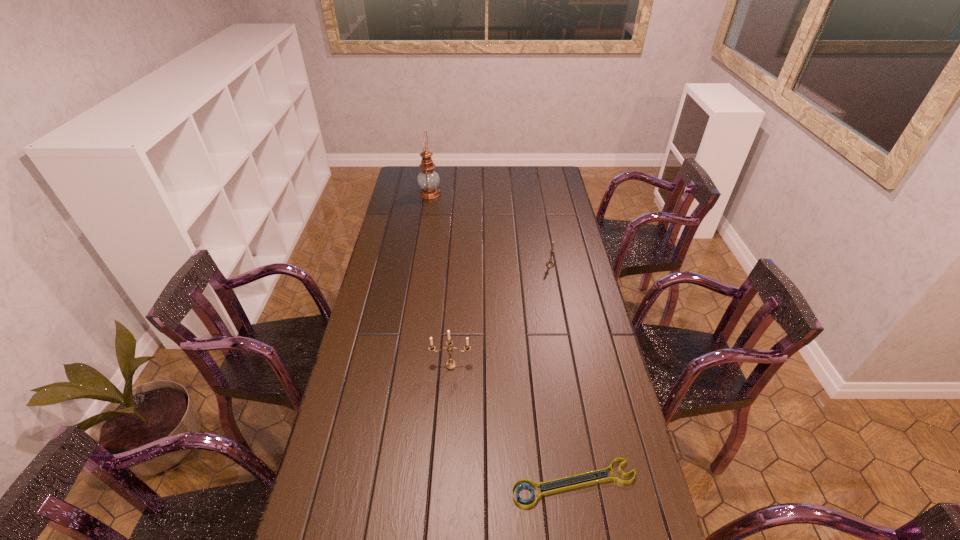
This screenshot has height=540, width=960. What are the coordinates of `free area in between the farther candle and the farthest object` in the screenshot? It's located at (490, 230).

Where is `vacant area that lies between the oil lamp and the shorter candle`? The height and width of the screenshot is (540, 960). vacant area that lies between the oil lamp and the shorter candle is located at coordinates (490, 230).

Locate which object is the closest to the oil lamp. Please provide its 2D coordinates. Your answer should be formatted as a tuple, i.e. [(x, y)], where the tuple contains the x and y coordinates of a point satisfying the conditions above.

[(550, 264)]

At what (x,y) coordinates should I click in order to perform the action: click on object that is the third closest to the third object from right to left. Please return your answer as a coordinate pair (x, y). This screenshot has width=960, height=540. Looking at the image, I should click on (428, 180).

This screenshot has width=960, height=540. I want to click on free space that satisfies the following two spatial constraints: 1. on the front side of the left candle; 2. on the left side of the tallest object, so click(402, 364).

Where is `free space in the image that satisfies the following two spatial constraints: 1. on the front side of the third object from right to left; 2. on the right side of the tallest object`? This screenshot has width=960, height=540. free space in the image that satisfies the following two spatial constraints: 1. on the front side of the third object from right to left; 2. on the right side of the tallest object is located at coordinates (402, 364).

The width and height of the screenshot is (960, 540). I want to click on free location that satisfies the following two spatial constraints: 1. on the back side of the third farthest object; 2. on the right side of the second shortest object, so click(457, 265).

You are a GUI agent. You are given a task and a screenshot of the screen. Output one action in this format:
    pyautogui.click(x=<x>, y=<y>)
    Task: Click on the vacant space that satisfies the following two spatial constraints: 1. on the front side of the shortest object; 2. on the left side of the leftmost object
    
    Given the screenshot: What is the action you would take?
    pyautogui.click(x=384, y=483)

Find the location of `free spot that satisfies the following two spatial constraints: 1. on the back side of the wrench; 2. on the left side of the right candle`. free spot that satisfies the following two spatial constraints: 1. on the back side of the wrench; 2. on the left side of the right candle is located at coordinates (540, 265).